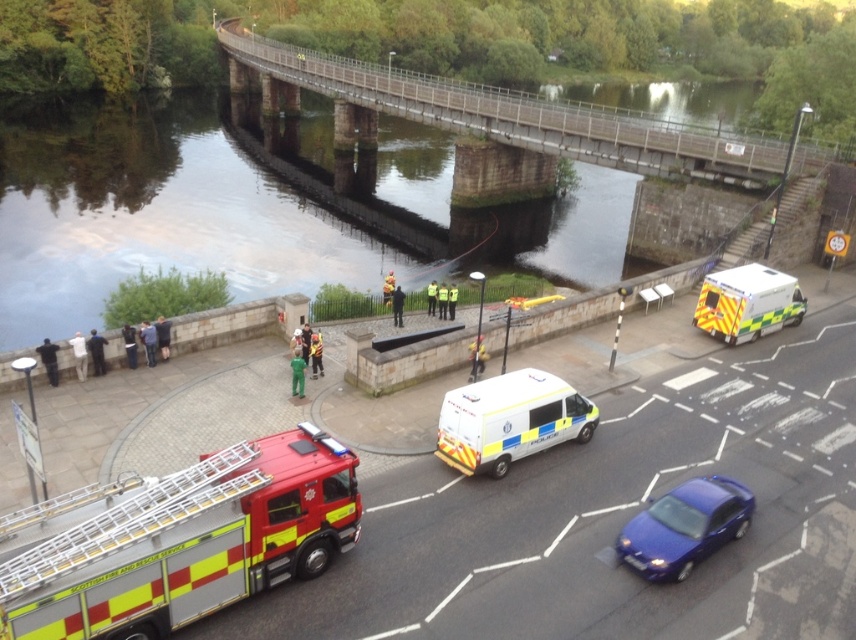
You are a pedestrian standing at the riverside scene. You see the yellow and red reflective fire truck at lower left and the glossy blue sedan at lower right. Which vehicle is positioned higher in the image?

The yellow and red reflective fire truck at lower left is above the glossy blue sedan at lower right, so it is positioned higher in the image.